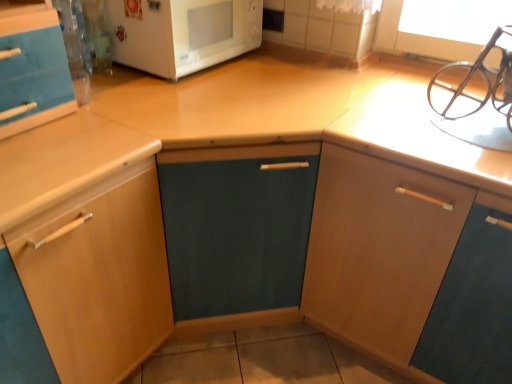
I want to click on vacant area on top of wooden cabinet at left, the second cabinetry viewed from the right (from a real-world perspective), so tap(44, 147).